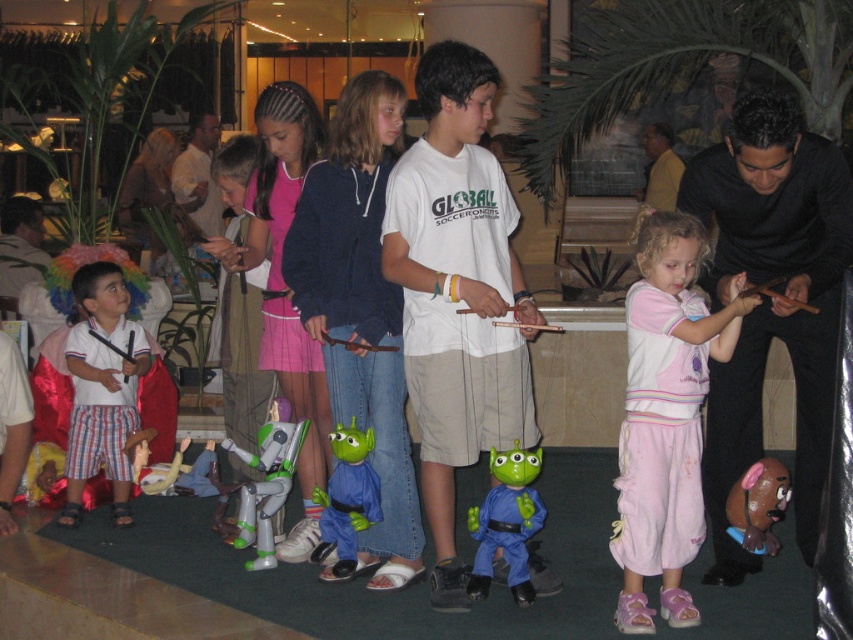
Question: Which point is farther to the camera?

Choices:
 (A) (664, 134)
 (B) (334, 360)
 (C) (268, 337)
 (D) (329, 436)

Answer: (A)

Question: Does metallic silver robot at lower left have a greater width compared to yellow shirt at center?

Choices:
 (A) yes
 (B) no

Answer: (A)

Question: Which of these objects is positioned closest to the pink fabric skirt at center?

Choices:
 (A) pink cotton pants at center
 (B) green rubber alien at center

Answer: (B)

Question: Does green rubber alien at center have a greater width compared to metallic silver robot at lower left?

Choices:
 (A) yes
 (B) no

Answer: (B)

Question: Considering the relative positions of white cotton shirt at left and green rubber alien at center in the image provided, where is white cotton shirt at left located with respect to green rubber alien at center?

Choices:
 (A) right
 (B) left

Answer: (B)

Question: Considering the real-world distances, which object is farthest from the white shirt at center?

Choices:
 (A) pink fabric skirt at center
 (B) metallic silver robot at lower left
 (C) matte pink skirt at center

Answer: (B)